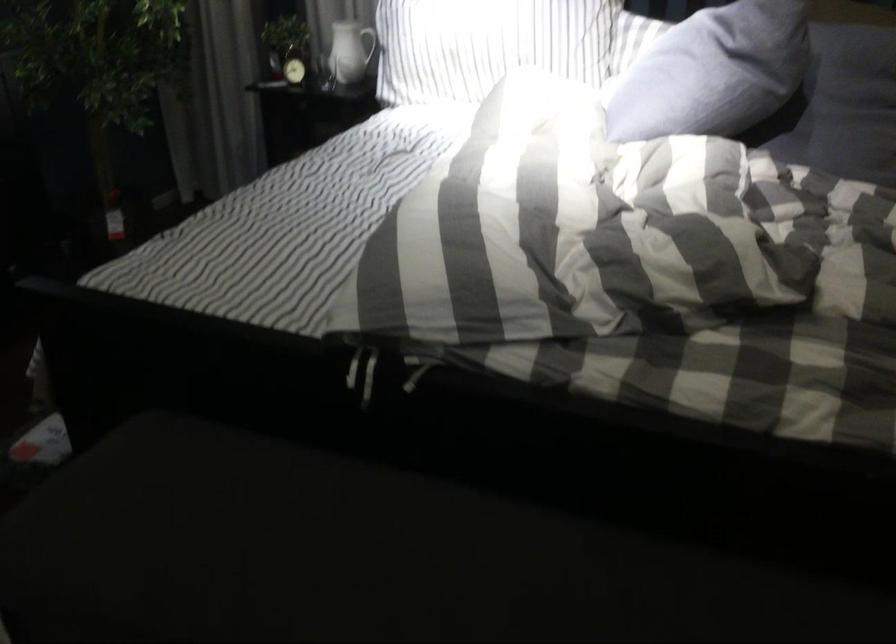
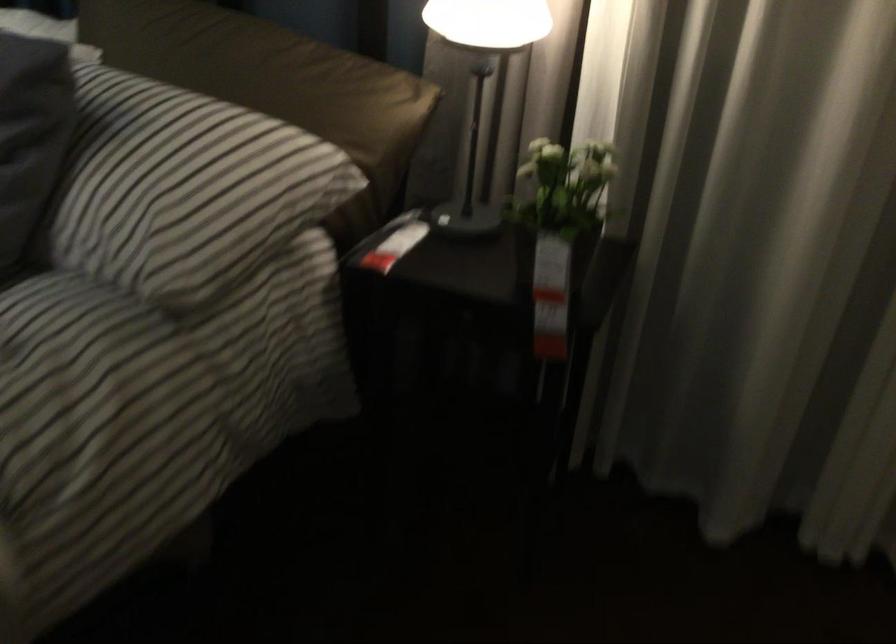
What movement of the cameraman would produce the second image?

The movement direction of the cameraman is right, forward.